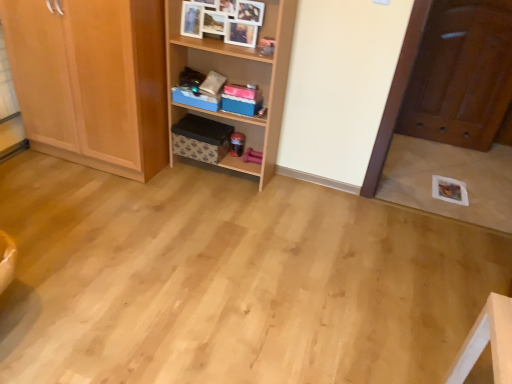
This screenshot has width=512, height=384. What are the coordinates of `vacant space that's between light wood cabinet at left and wooden shelf at center` in the screenshot? It's located at (192, 183).